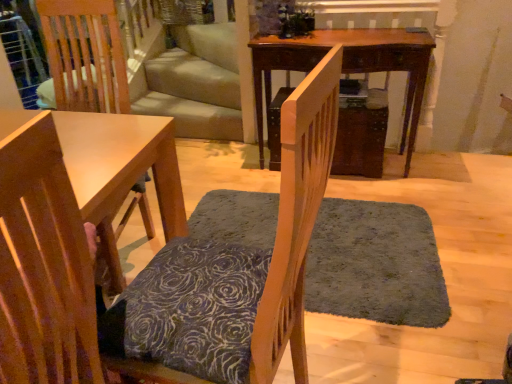
Identify the location of free area in between mahogany wood table at center and dark gray shaggy rug at center. This screenshot has width=512, height=384. (355, 193).